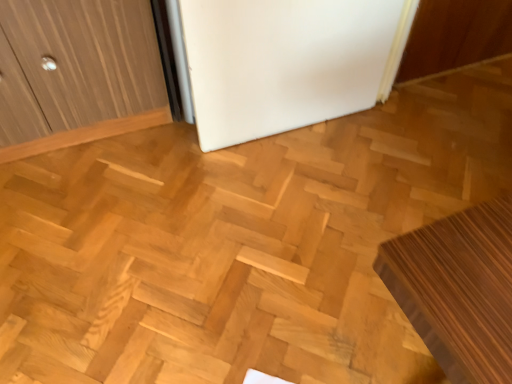
Question: From a real-world perspective, is white matte refrigerator at center on top of wooden bench at lower right?

Choices:
 (A) yes
 (B) no

Answer: (A)

Question: Is white matte refrigerator at center not within wooden bench at lower right?

Choices:
 (A) yes
 (B) no

Answer: (A)

Question: Is white matte refrigerator at center closer to camera compared to wooden bench at lower right?

Choices:
 (A) yes
 (B) no

Answer: (B)

Question: Considering the relative sizes of white matte refrigerator at center and wooden bench at lower right in the image provided, is white matte refrigerator at center thinner than wooden bench at lower right?

Choices:
 (A) no
 (B) yes

Answer: (B)

Question: Is white matte refrigerator at center behind wooden bench at lower right?

Choices:
 (A) no
 (B) yes

Answer: (B)

Question: Is white matte refrigerator at center beside wooden bench at lower right?

Choices:
 (A) yes
 (B) no

Answer: (B)

Question: Is wooden bench at lower right outside white matte refrigerator at center?

Choices:
 (A) no
 (B) yes

Answer: (B)

Question: Is white matte refrigerator at center at the back of wooden bench at lower right?

Choices:
 (A) no
 (B) yes

Answer: (A)

Question: Is wooden bench at lower right beside white matte refrigerator at center?

Choices:
 (A) no
 (B) yes

Answer: (A)

Question: Is wooden bench at lower right not near white matte refrigerator at center?

Choices:
 (A) yes
 (B) no

Answer: (A)

Question: Can you confirm if wooden bench at lower right is positioned to the right of white matte refrigerator at center?

Choices:
 (A) yes
 (B) no

Answer: (A)

Question: Could you tell me if wooden bench at lower right is facing white matte refrigerator at center?

Choices:
 (A) yes
 (B) no

Answer: (B)

Question: Is white matte refrigerator at center inside the boundaries of wooden bench at lower right, or outside?

Choices:
 (A) inside
 (B) outside

Answer: (B)